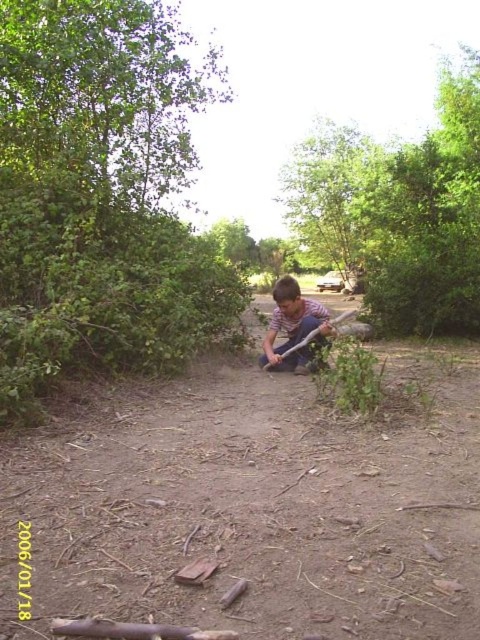
You are a hiker lost in the woods and see the brown dirt path at center and the green leafy tree at upper center. Which object is positioned to the left of the other?

The brown dirt path at center is to the left of green leafy tree at upper center.

From the picture: You are standing at the edge of the forest and see the green leafy bush at upper left and the striped shirt at center. Which object is positioned to the left of the other?

The green leafy bush at upper left is to the left of the striped shirt at center.

You are a hiker who wants to take a photo of the striped shirt at center without stepping on the brown dirt path at center. Where should you position yourself to take the photo?

The brown dirt path at center is located below the striped shirt at center, so you can position yourself behind the striped shirt at center to take the photo without stepping on the path.